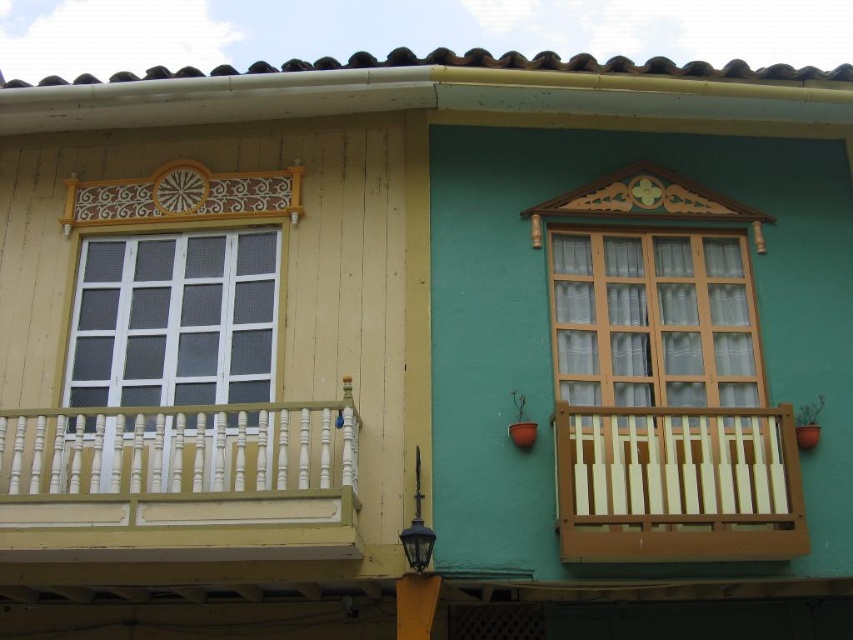
You are a painter standing on the ground in front of the building. You need to paint both the white painted wood balcony at left and the white wooden window at left. Which one should you paint first if you want to start with the closer object?

The white painted wood balcony at left is 5.62 feet away from the white wooden window at left, so you should paint the white painted wood balcony at left first since it is closer to you.

You are standing in front of the building and want to hang a wind chime on the wooden balcony. Which balcony should you choose between the white painted wood balcony at left and the wooden at right?

The white painted wood balcony at left is located above the wooden at right, so you should choose the wooden at right since it is lower and more accessible for hanging a wind chime.

You are standing in front of the building and want to locate the point at coordinates (677, 484). Based on the scene description, where exactly would this point be located?

The point at coordinates (677, 484) is on the wooden balcony at the right side of the building.